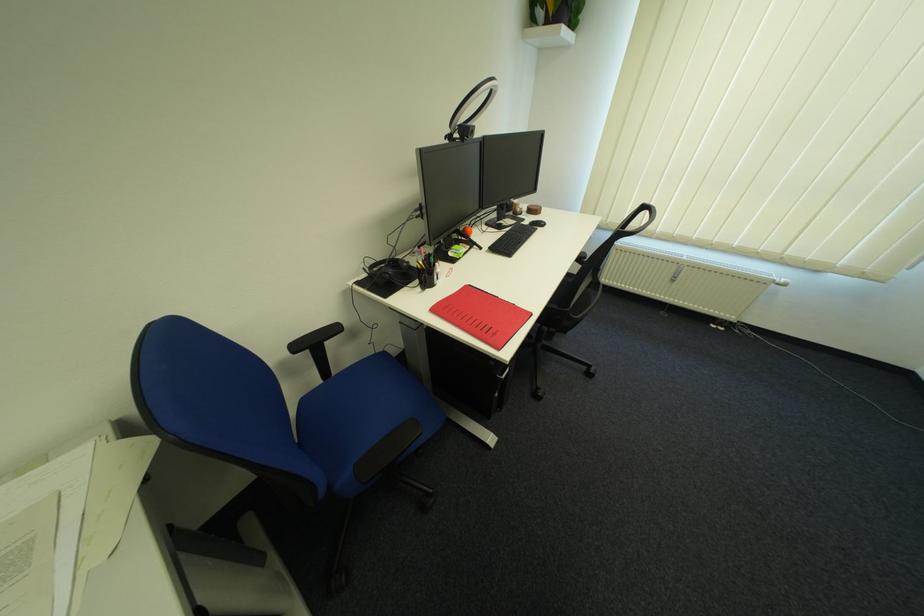
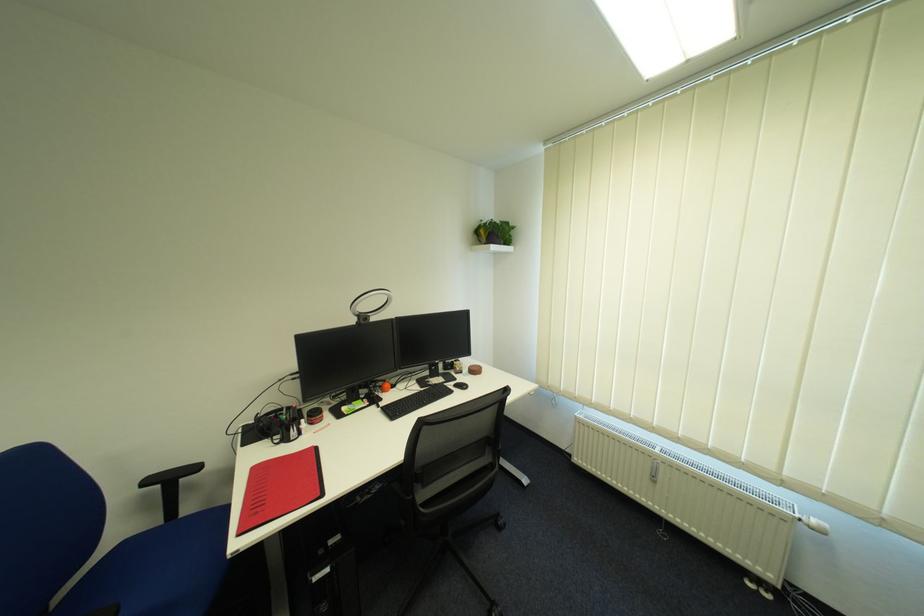
In the second image, find the point that corresponds to pixel 330 382 in the first image.

(171, 524)